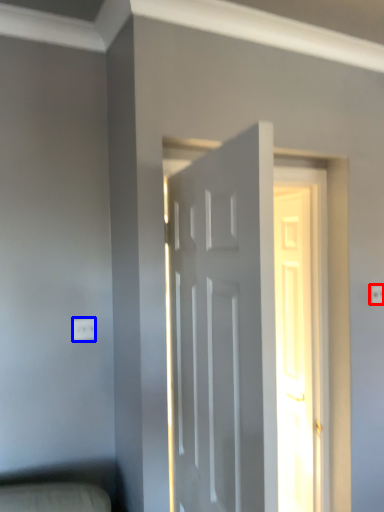
Question: Which point is further to the camera, electric outlet (highlighted by a red box) or electric outlet (highlighted by a blue box)?

Choices:
 (A) electric outlet
 (B) electric outlet

Answer: (A)